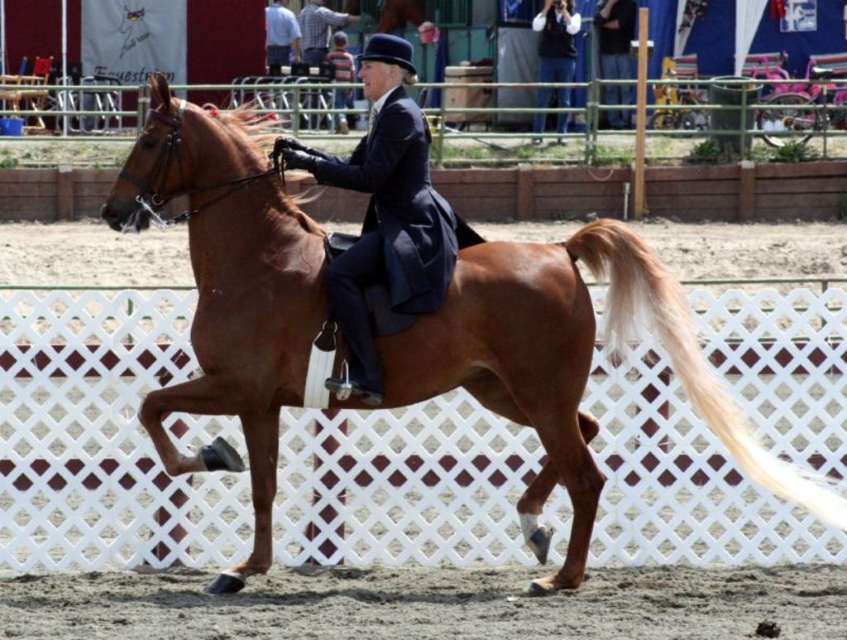
Looking at this image, is brown glossy horse at center taller than shiny navy blue riding jacket at center?

Correct, brown glossy horse at center is much taller as shiny navy blue riding jacket at center.

Find the location of a particular element. This screenshot has height=640, width=847. brown glossy horse at center is located at coordinates (567, 368).